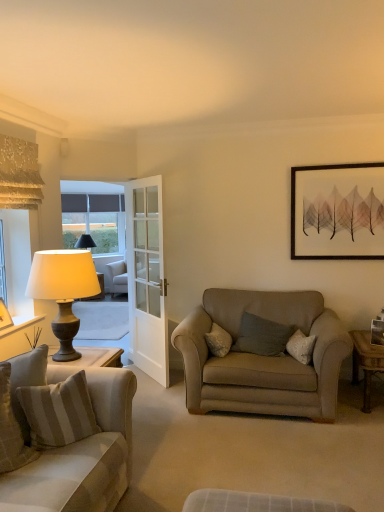
Question: Visually, is striped fabric pillow at lower left, acting as the 1th pillow starting from the left, positioned to the left or to the right of beige fabric couch at left?

Choices:
 (A) right
 (B) left

Answer: (A)

Question: Does point (6, 436) appear closer or farther from the camera than point (61, 397)?

Choices:
 (A) farther
 (B) closer

Answer: (B)

Question: Estimate the real-world distances between objects in this image. Which object is farther from the wooden desk at right?

Choices:
 (A) wooden picture frame at left, the first picture frame in the left-to-right sequence
 (B) beige striped cushion at lower left, which appears as the 2th pillow when viewed from the front
 (C) matte black picture frame at upper right, placed as the first picture frame when sorted from back to front
 (D) matte gray lamp at left
 (E) striped fabric pillow at lower left, acting as the 1th pillow starting from the left

Answer: (A)

Question: Estimate the real-world distances between objects in this image. Which object is farther from the beige fabric couch at left?

Choices:
 (A) matte gray lamp at left
 (B) wooden picture frame at left, which appears as the 3th picture frame when viewed from the right
 (C) matte black picture frame at upper right, which is counted as the 2th picture frame, starting from the left
 (D) striped fabric pillow at lower left, acting as the 3th pillow starting from the back
 (E) beige striped cushion at lower left, the 2th pillow viewed from the right

Answer: (C)